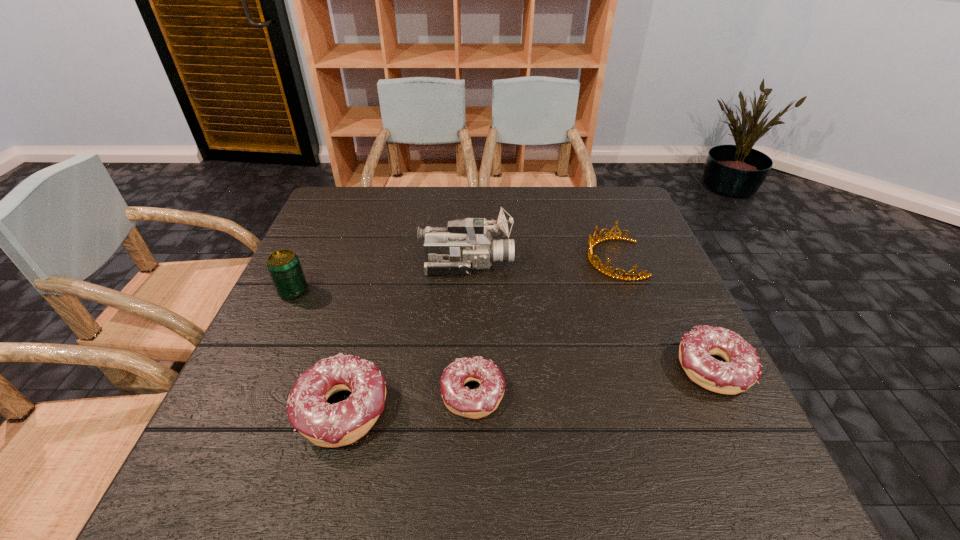
Image resolution: width=960 pixels, height=540 pixels. What are the coordinates of `tiara at the right edge` in the screenshot? It's located at (591, 243).

The image size is (960, 540). Identify the location of object at the near left corner. (329, 425).

Identify the location of object located in the near right corner section of the desktop. (x=742, y=369).

At what (x,y) coordinates should I click in order to perform the action: click on free space at the far edge. Please return your answer as a coordinate pair (x, y). The width and height of the screenshot is (960, 540). Looking at the image, I should click on (381, 197).

Where is `vacant point at the near edge`? The width and height of the screenshot is (960, 540). vacant point at the near edge is located at coordinates (502, 430).

Image resolution: width=960 pixels, height=540 pixels. What are the coordinates of `vacant space at the left edge of the desktop` in the screenshot? It's located at (306, 272).

Find the location of a particular element. vacant space at the right edge of the desktop is located at coordinates (614, 241).

You are a GUI agent. You are given a task and a screenshot of the screen. Output one action in this format:
    pyautogui.click(x=<x>, y=<y>)
    Task: Click on the free space at the far left corner
    The height and width of the screenshot is (540, 960).
    Given the screenshot: What is the action you would take?
    pyautogui.click(x=350, y=187)

Identify the location of free space at the far right corner of the desktop. (592, 225).

I want to click on free space at the near right corner, so click(745, 423).